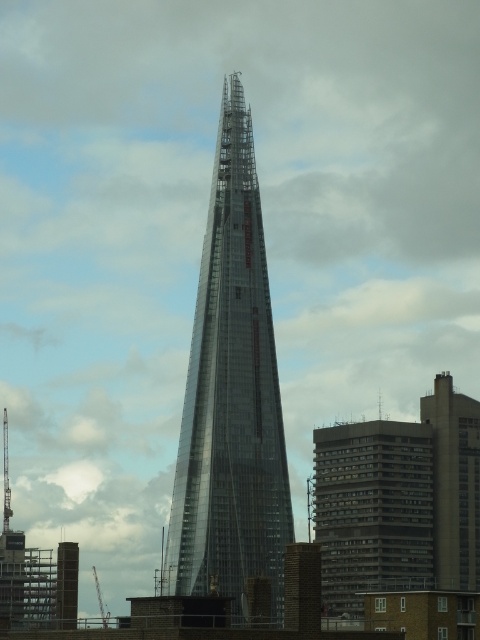
Question: Which object appears farthest from the camera in this image?

Choices:
 (A) transparent glass tower at center
 (B) transparent glass spire at left

Answer: (B)

Question: Does transparent glass tower at center have a lesser width compared to transparent glass spire at left?

Choices:
 (A) no
 (B) yes

Answer: (A)

Question: Is transparent glass tower at center to the right of transparent glass spire at left from the viewer's perspective?

Choices:
 (A) yes
 (B) no

Answer: (A)

Question: Which of the following is the farthest from the observer?

Choices:
 (A) transparent glass spire at left
 (B) transparent glass tower at center

Answer: (A)

Question: Is transparent glass tower at center thinner than transparent glass spire at left?

Choices:
 (A) yes
 (B) no

Answer: (B)